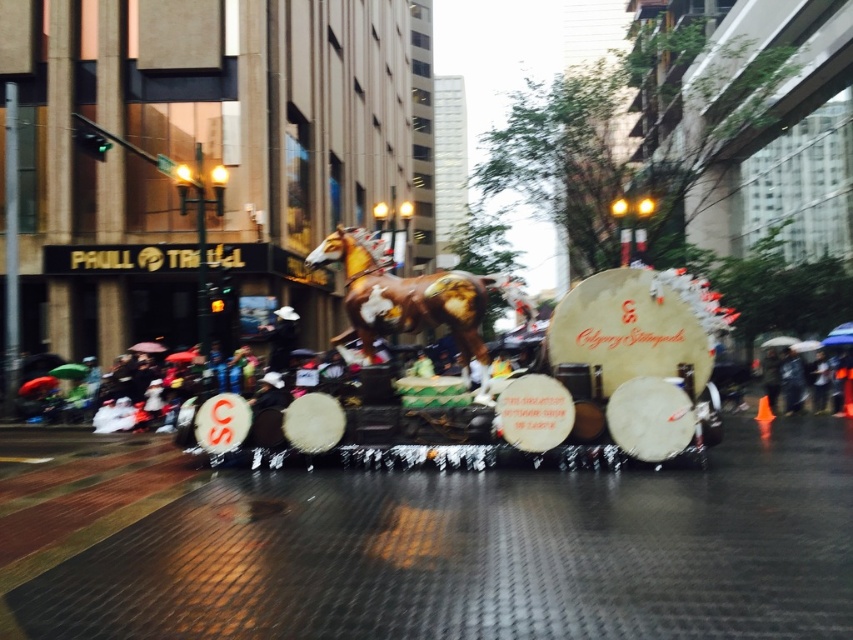
Question: Which object appears closest to the camera in this image?

Choices:
 (A) shiny gold horse at center
 (B) raincoat fabric umbrella at lower right
 (C) black fabric umbrella at lower right

Answer: (A)

Question: Which object appears closest to the camera in this image?

Choices:
 (A) raincoat fabric umbrella at lower right
 (B) black fabric umbrella at lower right

Answer: (A)

Question: Can you confirm if shiny gold horse at center is thinner than raincoat fabric umbrella at lower right?

Choices:
 (A) yes
 (B) no

Answer: (B)

Question: Observing the image, what is the correct spatial positioning of shiny gold horse at center in reference to raincoat fabric person at lower right?

Choices:
 (A) left
 (B) right

Answer: (A)

Question: Based on their relative distances, which object is farther from the shiny brown horse at center?

Choices:
 (A) green fabric umbrella at center
 (B) raincoat fabric person at lower right
 (C) black fabric umbrella at lower right
 (D) shiny gold horse at center

Answer: (C)

Question: Considering the relative positions of raincoat fabric umbrella at lower right and black fabric umbrella at lower right in the image provided, where is raincoat fabric umbrella at lower right located with respect to black fabric umbrella at lower right?

Choices:
 (A) left
 (B) right

Answer: (B)